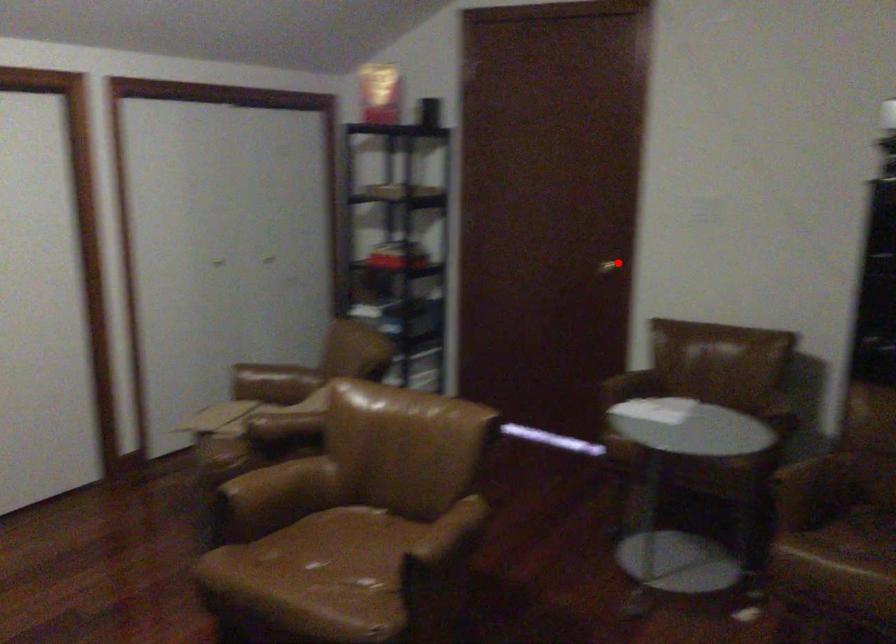
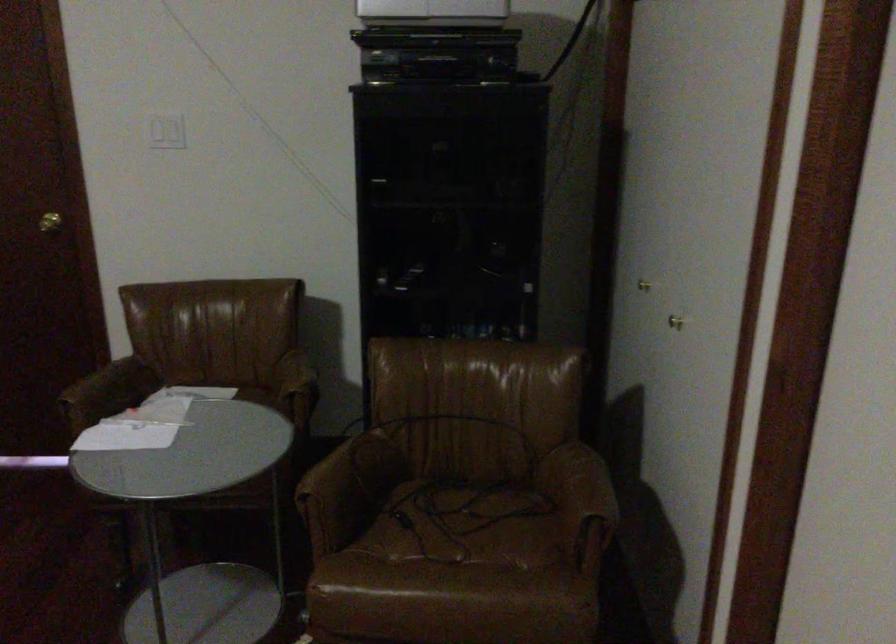
Where in the second image is the point corresponding to the highlighted location from the first image?

(49, 222)